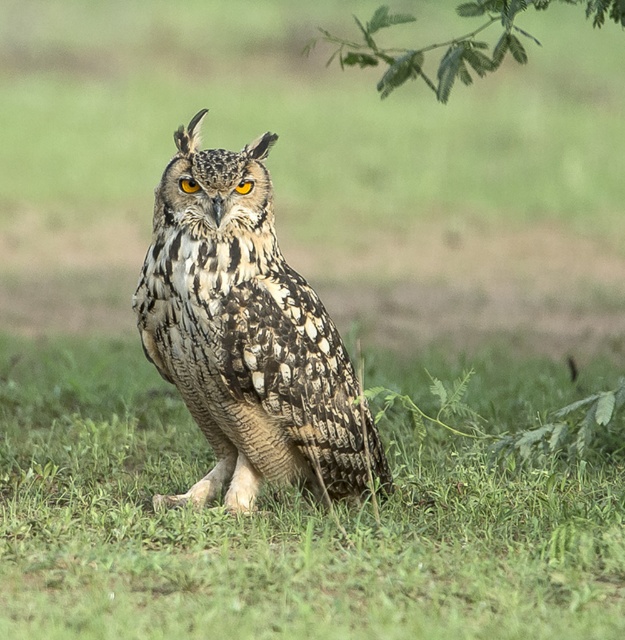
Question: From the image, what is the correct spatial relationship of camouflage feathered owl at center in relation to green leafy branch at upper center?

Choices:
 (A) below
 (B) above

Answer: (A)

Question: Can you confirm if speckled feather owl at center is smaller than camouflage feathered owl at center?

Choices:
 (A) yes
 (B) no

Answer: (B)

Question: Does speckled feather owl at center have a smaller size compared to camouflage feathered owl at center?

Choices:
 (A) no
 (B) yes

Answer: (A)

Question: Which point is closer to the camera?

Choices:
 (A) click(450, 561)
 (B) click(246, 349)
 (C) click(486, 28)

Answer: (B)

Question: Which is nearer to the camouflage feathered owl at center?

Choices:
 (A) speckled feather owl at center
 (B) green leafy branch at upper center

Answer: (A)

Question: Which point is farther to the camera?

Choices:
 (A) green leafy branch at upper center
 (B) camouflage feathered owl at center
 (C) speckled feather owl at center

Answer: (B)